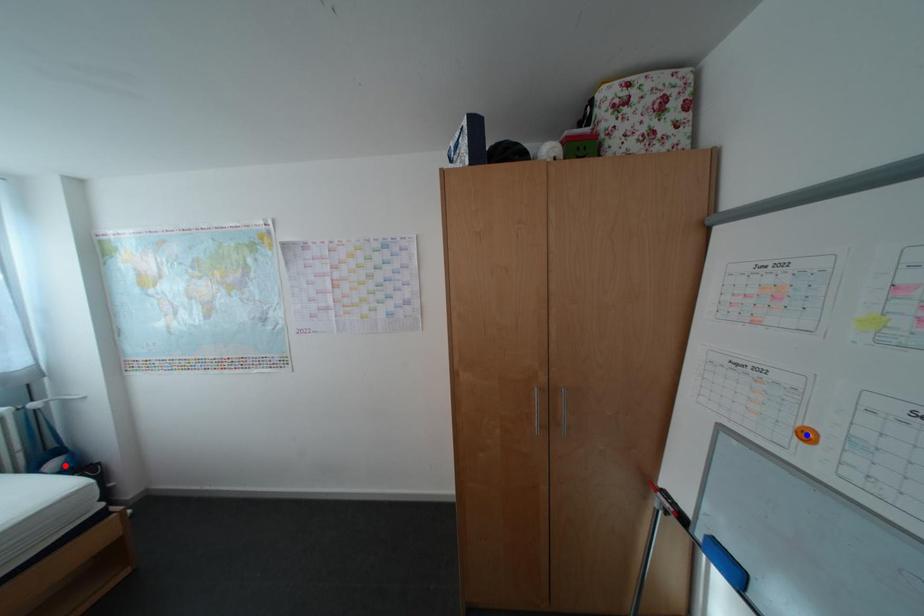
Question: In the image, two points are highlighted. Which point is nearer to the camera? Reply with the corresponding letter.

Choices:
 (A) blue point
 (B) red point

Answer: (A)